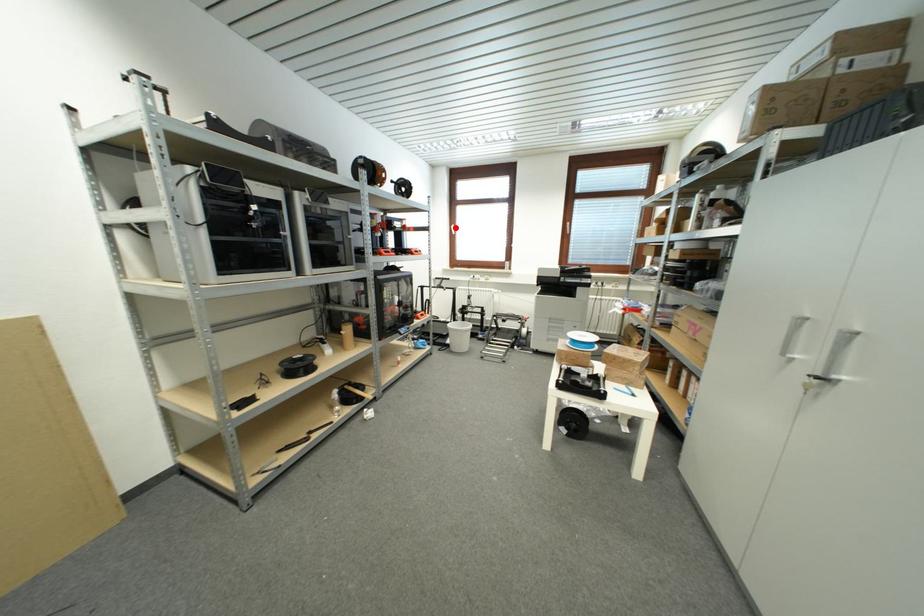
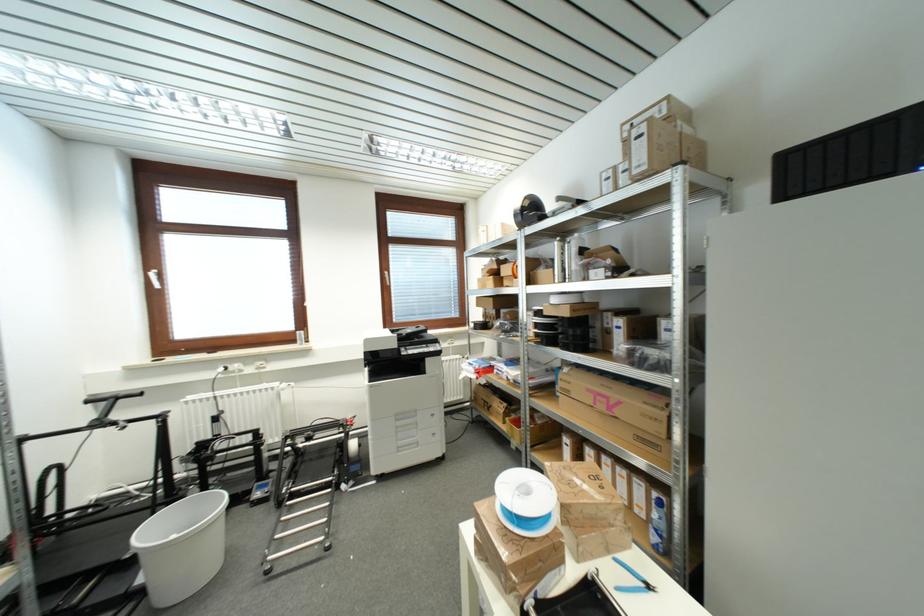
In the second image, find the point that corresponds to the highlighted location in the first image.

(151, 273)